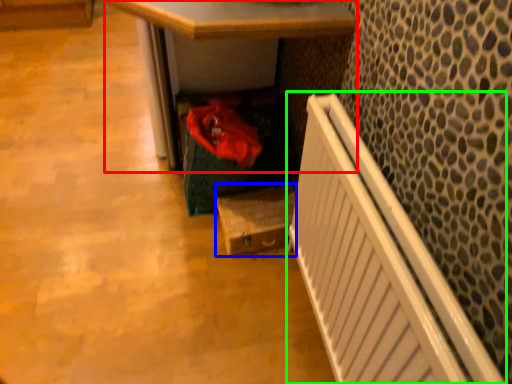
Question: Which object is the farthest from desk (highlighted by a red box)? Choose among these: box (highlighted by a blue box) or radiator (highlighted by a green box).

Choices:
 (A) box
 (B) radiator

Answer: (B)